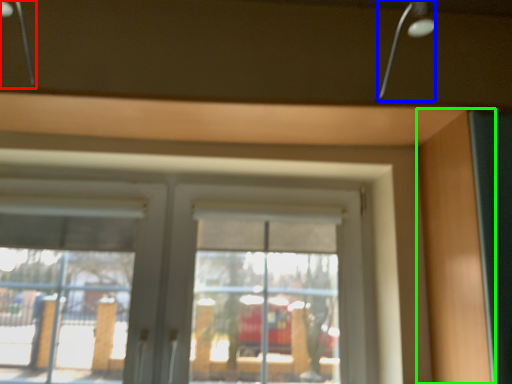
Question: Based on their relative distances, which object is farther from lamp (highlighted by a red box)? Choose from lamp (highlighted by a blue box) and garage door (highlighted by a green box).

Choices:
 (A) lamp
 (B) garage door

Answer: (B)